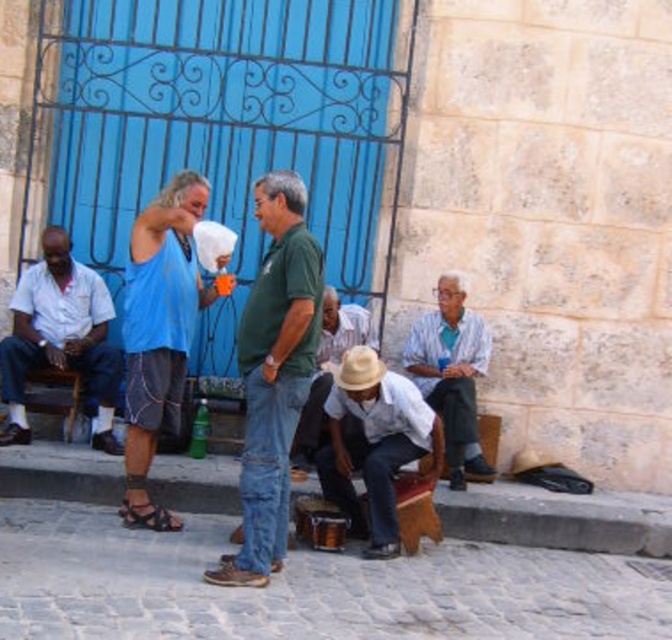
Is smooth stone curb at lower center smaller than brown leather sandal at lower left?

No, smooth stone curb at lower center is not smaller than brown leather sandal at lower left.

Is smooth stone curb at lower center below brown leather sandal at lower left?

No, smooth stone curb at lower center is not below brown leather sandal at lower left.

Does point (179, 468) come in front of point (140, 522)?

No, it is not.

You are a GUI agent. You are given a task and a screenshot of the screen. Output one action in this format:
    pyautogui.click(x=<x>, y=<y>)
    Task: Click on the smooth stone curb at lower center
    This screenshot has width=672, height=640.
    Given the screenshot: What is the action you would take?
    pyautogui.click(x=558, y=518)

Can you confirm if cobblestone pavement at lower center is thinner than light brown straw hat at center?

Yes.

Does point (24, 628) lie in front of point (390, 541)?

Yes, point (24, 628) is in front of point (390, 541).

The width and height of the screenshot is (672, 640). Identify the location of cobblestone pavement at lower center. (306, 588).

Does white straw hat at center appear under brown leather sandal at lower left?

No, white straw hat at center is not below brown leather sandal at lower left.

Can you confirm if white straw hat at center is taller than brown leather sandal at lower left?

Indeed, white straw hat at center has a greater height compared to brown leather sandal at lower left.

This screenshot has width=672, height=640. Identify the location of white straw hat at center. (327, 372).